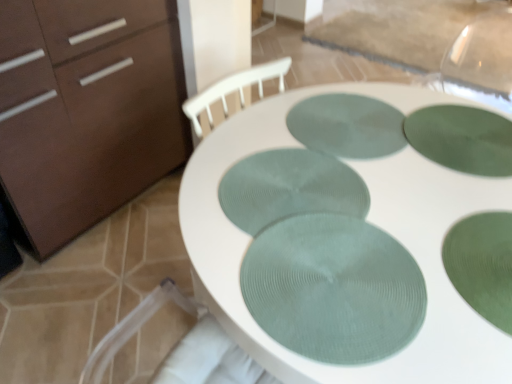
In order to click on free point behind green textured glass at center, acting as the second glass plate starting from the front in this screenshot , I will do `click(442, 176)`.